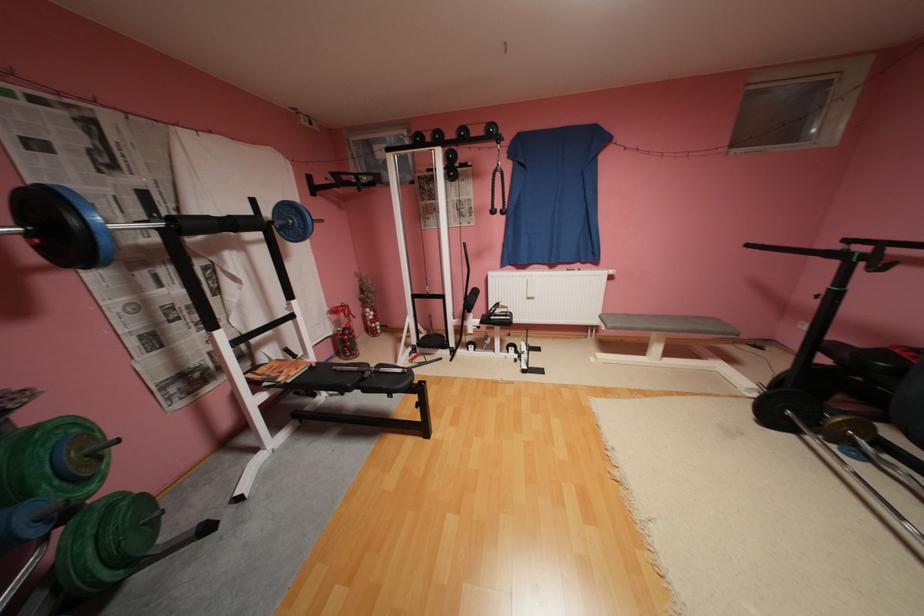
What do you see at coordinates (849, 251) in the screenshot? I see `the black machine handlebar` at bounding box center [849, 251].